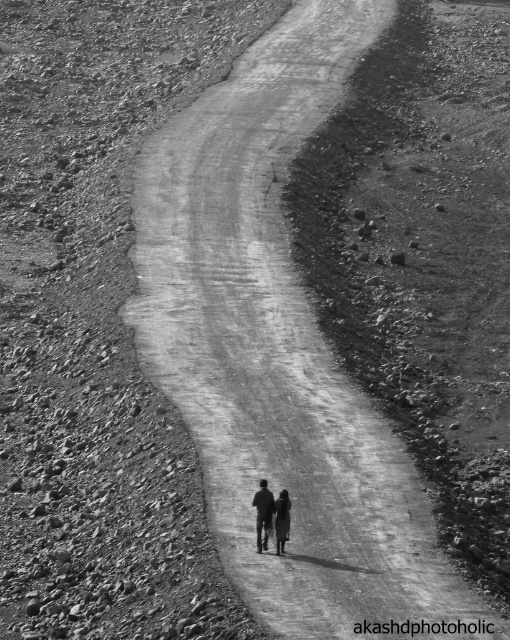
You are a photographer trying to capture both the silhouette figure at center and the dark fabric figure at center in one frame. Given that your camera has a focal length of 50mm and the minimum distance between subjects for clear focus is 4 inches, will you need to adjust your camera settings to ensure both figures are in focus?

The silhouette figure at center is 3.51 inches away from the dark fabric figure at center. Since the minimum distance required for clear focus is 4 inches, the current distance is insufficient. You will need to adjust your camera settings to ensure both figures are in focus.

You are a photographer trying to capture both the silhouette figure at center and the dark fabric figure at center in a single frame. Based on their widths, which figure should you adjust your camera angle to focus on first to ensure both fit in the frame?

The silhouette figure at center might be wider than dark fabric figure at center, so you should focus on the silhouette figure at center first to accommodate its width and ensure both figures fit in the frame.